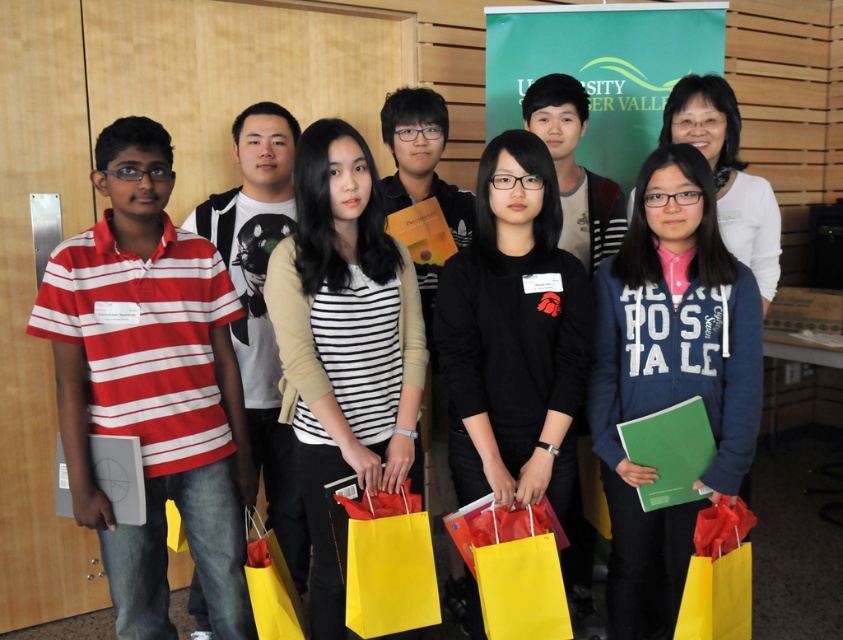
You are organizing a photo shoot and need to ensure that the red striped polo shirt at left and the black matte shirt at center are visible in the frame. Given their sizes, which shirt should you focus on to ensure it doesn not get cropped out?

The red striped polo shirt at left is larger in width than the black matte shirt at center, so you should focus on ensuring the red striped polo shirt at left is fully visible to prevent cropping.

You are organizing a photo shoot and need to ensure that the black matte shirt at center and the yellow paper shopping bag at lower left are both visible in the frame. Based on their sizes, which object should you focus on to ensure both are in the shot?

The black matte shirt at center is taller than the yellow paper shopping bag at lower left. To ensure both are visible, focus on the black matte shirt at center as it requires more vertical space, and the smaller yellow paper shopping bag at lower left will naturally fit into the frame.

You are organizing a photo shoot and need to decide which item to use as a foreground prop. The striped jersey at center and the yellow paper shopping bag at lower left are available. Which item should you choose if you want the prop to be larger in the frame?

The striped jersey at center is bigger than the yellow paper shopping bag at lower left, so you should choose the striped jersey at center as the foreground prop to have a larger item in the frame.